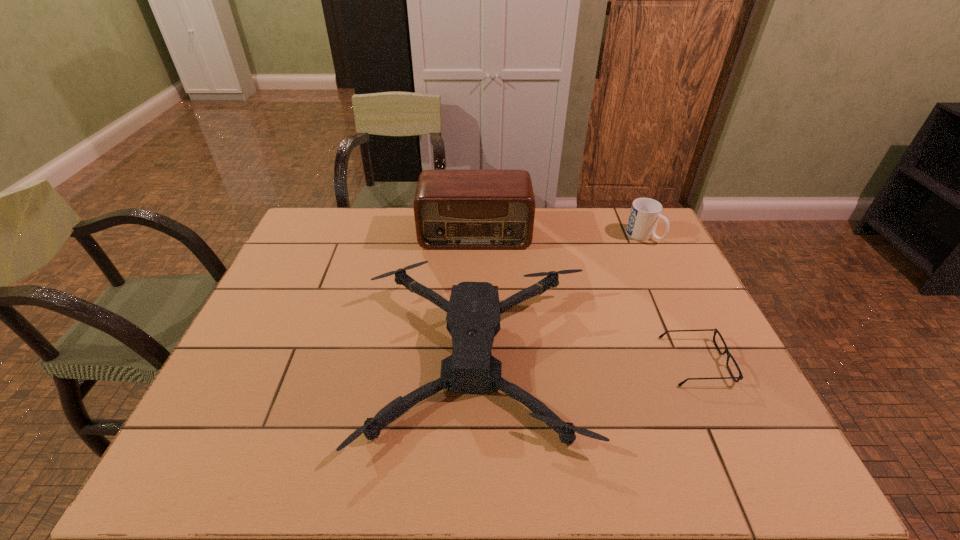
I want to click on vacant space that satisfies the following two spatial constraints: 1. on the back side of the third tallest object; 2. on the right side of the mug, so click(478, 235).

You are a GUI agent. You are given a task and a screenshot of the screen. Output one action in this format:
    pyautogui.click(x=<x>, y=<y>)
    Task: Click on the free space in the image that satisfies the following two spatial constraints: 1. on the front side of the mug; 2. on the front-facing side of the spectacles
    Image resolution: width=960 pixels, height=540 pixels.
    Given the screenshot: What is the action you would take?
    pyautogui.click(x=703, y=361)

Locate an element on the screen. free space that satisfies the following two spatial constraints: 1. on the front panel of the mug; 2. on the right side of the radio receiver is located at coordinates (475, 235).

You are a GUI agent. You are given a task and a screenshot of the screen. Output one action in this format:
    pyautogui.click(x=<x>, y=<y>)
    Task: Click on the vacant area that satisfies the following two spatial constraints: 1. on the front panel of the tallest object; 2. on the right side of the mug
    The image size is (960, 540).
    Given the screenshot: What is the action you would take?
    pyautogui.click(x=475, y=235)